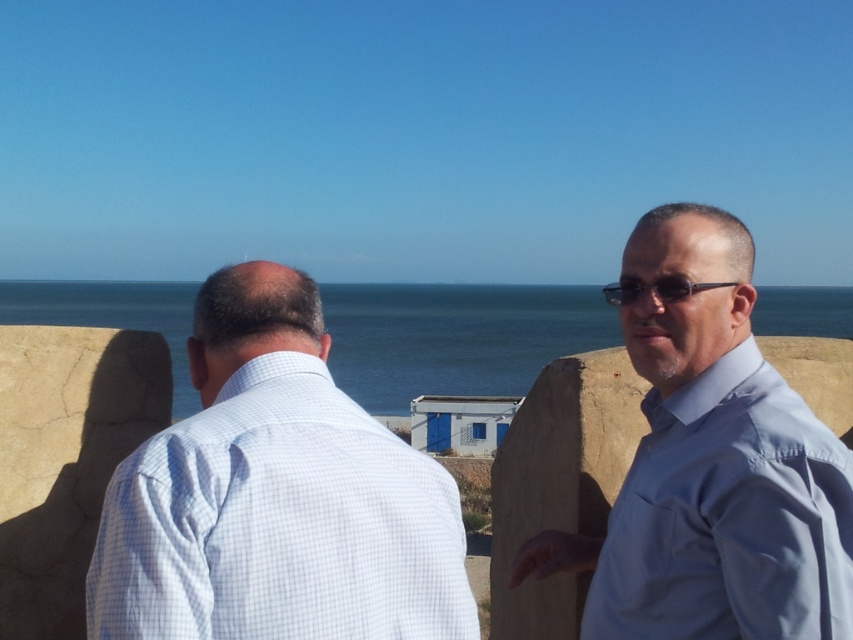
Between white checkered shirt at left and blue water at center, which one is positioned higher?

blue water at center

Is white checkered shirt at left taller than blue water at center?

No.

At what (x,y) coordinates should I click in order to perform the action: click on white checkered shirt at left. Please return your answer as a coordinate pair (x, y). The width and height of the screenshot is (853, 640). Looking at the image, I should click on (276, 497).

Is white checkered shirt at left to the right of blue glossy shirt at right from the viewer's perspective?

Incorrect, white checkered shirt at left is not on the right side of blue glossy shirt at right.

Is point (252, 468) behind point (688, 454)?

No.

Image resolution: width=853 pixels, height=640 pixels. Find the location of `white checkered shirt at left`. white checkered shirt at left is located at coordinates (276, 497).

Between white checkered shirt at left and black plastic sunglasses at right, which one has more height?

white checkered shirt at left

Is white checkered shirt at left behind black plastic sunglasses at right?

No, it is not.

Is point (427, 625) in front of point (606, 296)?

Yes.

The height and width of the screenshot is (640, 853). Identify the location of white checkered shirt at left. (276, 497).